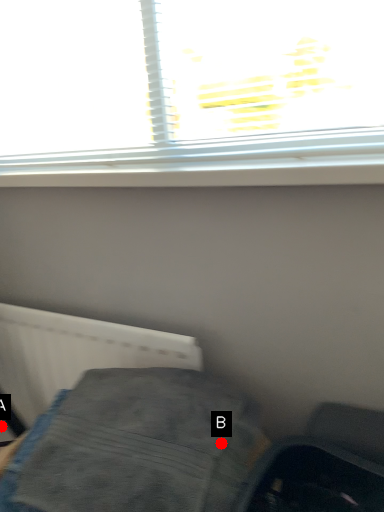
Question: Two points are circled on the image, labeled by A and B beside each circle. Which point appears farthest from the camera in this image?

Choices:
 (A) A is further
 (B) B is further

Answer: (A)